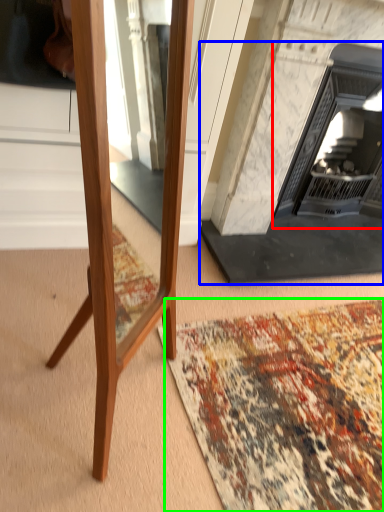
Question: Which object is the closest to the fireplace (highlighted by a red box)? Choose among these: fireplace (highlighted by a blue box) or mat (highlighted by a green box).

Choices:
 (A) fireplace
 (B) mat

Answer: (A)